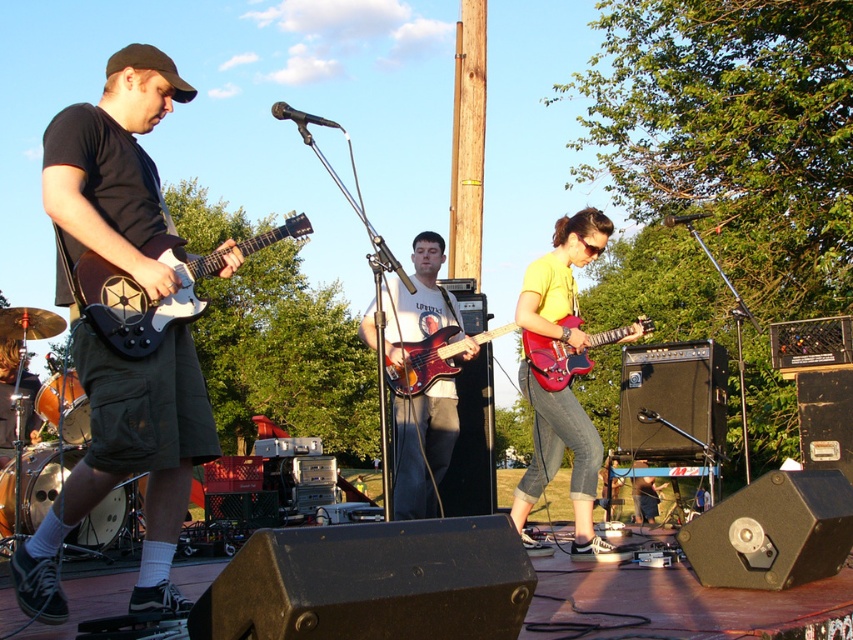
You are a stagehand who needs to move the matte black guitar at left and the matte red electric guitar at center to the storage room. Which guitar should you move first if you want to follow the order from left to right as seen from the audience perspective?

The matte black guitar at left should be moved first as it is positioned to the left of the matte red electric guitar at center, following the left to right order from the audience perspective.

You are a stagehand setting up for a concert and need to place a new microphone stand between the matte red electric guitar at center and the white matte electric guitar at left. Based on their positions, which guitar should the stand be closer to?

The matte red electric guitar at center should be closer to the stand because it is positioned under the white matte electric guitar at left, indicating it is lower in the frame and likely closer to the front of the stage.